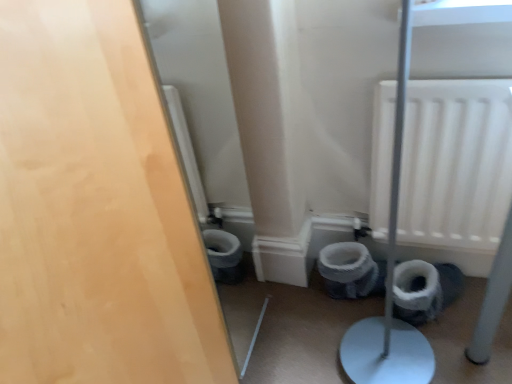
Question: Considering the positions of point (360, 278) and point (153, 195), is point (360, 278) closer or farther from the camera than point (153, 195)?

Choices:
 (A) farther
 (B) closer

Answer: (A)

Question: In the image, is white fabric toilet bowl at lower center on the left side or the right side of matte wood door at left?

Choices:
 (A) right
 (B) left

Answer: (A)

Question: Considering the real-world distances, which object is farthest from the white fabric toilet bowl at lower center?

Choices:
 (A) white textured toilet paper at lower right
 (B) white matte radiator at upper right
 (C) matte wood door at left

Answer: (C)

Question: Estimate the real-world distances between objects in this image. Which object is closer to the white textured toilet paper at lower right?

Choices:
 (A) white matte radiator at upper right
 (B) white fabric toilet bowl at lower center
 (C) matte wood door at left

Answer: (B)